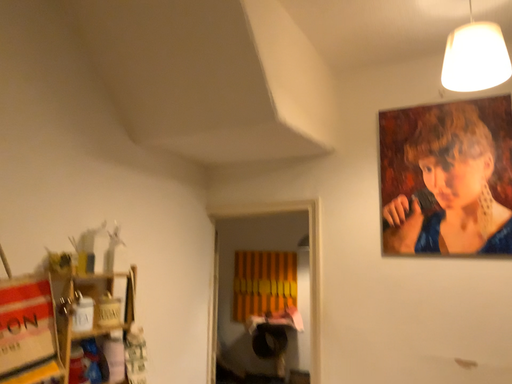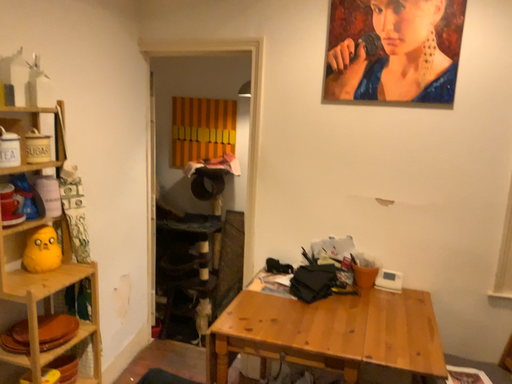
Question: How did the camera likely rotate when shooting the video?

Choices:
 (A) rotated downward
 (B) rotated upward

Answer: (A)